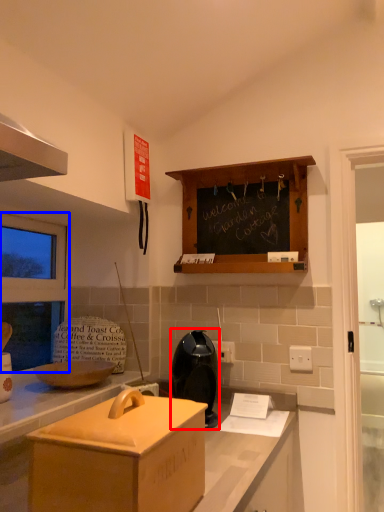
Question: Among these objects, which one is farthest to the camera, appliance (highlighted by a red box) or window screen (highlighted by a blue box)?

Choices:
 (A) appliance
 (B) window screen

Answer: (B)